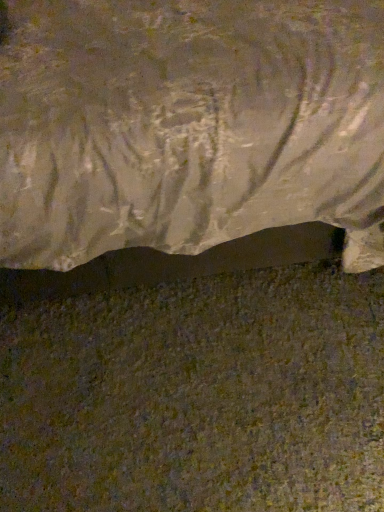
The width and height of the screenshot is (384, 512). Describe the element at coordinates (188, 125) in the screenshot. I see `matte plastic bed at center` at that location.

In order to click on matte plastic bed at center in this screenshot , I will do `click(188, 125)`.

I want to click on matte plastic bed at center, so (188, 125).